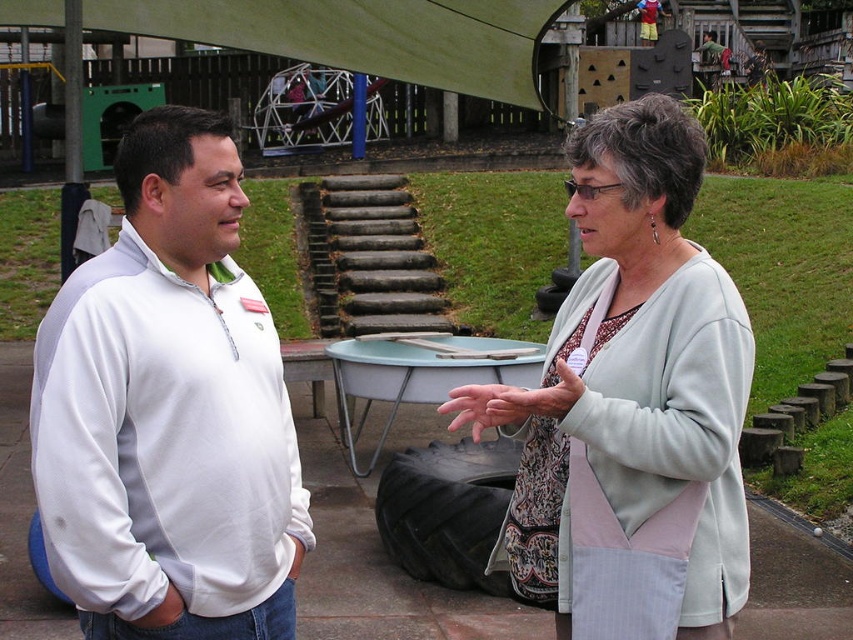
Question: Among these objects, which one is nearest to the camera?

Choices:
 (A) light gray cardigan at center
 (B) white fabric shirt at left

Answer: (B)

Question: Can you confirm if white fabric shirt at left is smaller than light gray cardigan at center?

Choices:
 (A) no
 (B) yes

Answer: (B)

Question: Estimate the real-world distances between objects in this image. Which object is farther from the light gray cardigan at center?

Choices:
 (A) green wood canopy at upper center
 (B) white fabric shirt at left

Answer: (A)

Question: Does white fabric shirt at left appear on the right side of green wood canopy at upper center?

Choices:
 (A) yes
 (B) no

Answer: (A)

Question: Which point is farther to the camera?

Choices:
 (A) (440, 65)
 (B) (543, 604)

Answer: (A)

Question: Does light gray cardigan at center have a larger size compared to green wood canopy at upper center?

Choices:
 (A) no
 (B) yes

Answer: (A)